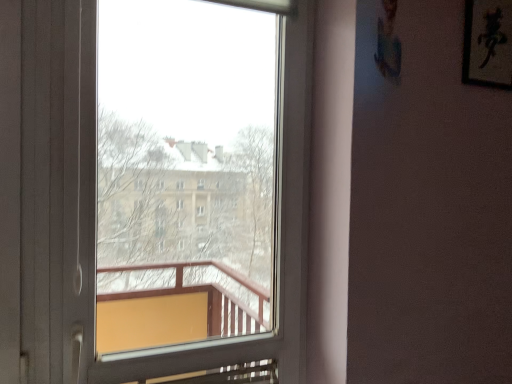
Locate an element on the screen. The width and height of the screenshot is (512, 384). black paper at upper right is located at coordinates (488, 43).

Image resolution: width=512 pixels, height=384 pixels. What do you see at coordinates (488, 43) in the screenshot? I see `black paper at upper right` at bounding box center [488, 43].

This screenshot has height=384, width=512. Describe the element at coordinates (280, 224) in the screenshot. I see `transparent glass window at center` at that location.

In the scene shown: What is the approximate width of transparent glass window at center?

transparent glass window at center is 3.85 inches in width.

Where is `transparent glass window at center`? This screenshot has height=384, width=512. transparent glass window at center is located at coordinates (280, 224).

Where is `black paper at upper right`? black paper at upper right is located at coordinates (488, 43).

Considering the relative positions of transparent glass window at center and black paper at upper right in the image provided, is transparent glass window at center to the left or to the right of black paper at upper right?

Based on their positions, transparent glass window at center is located to the left of black paper at upper right.

Is transparent glass window at center further to the viewer compared to black paper at upper right?

No, the depth of transparent glass window at center is less than that of black paper at upper right.

Which is closer, (287,76) or (510,39)?

The point (287,76) is in front.

From the image's perspective, is transparent glass window at center over black paper at upper right?

No, from the image's perspective, transparent glass window at center is not over black paper at upper right.

From a real-world perspective, is transparent glass window at center physically above black paper at upper right?

No, from a real-world perspective, transparent glass window at center is not over black paper at upper right

Considering the sizes of transparent glass window at center and black paper at upper right in the image, is transparent glass window at center wider or thinner than black paper at upper right?

transparent glass window at center is wider than black paper at upper right.

Who is shorter, transparent glass window at center or black paper at upper right?

black paper at upper right.

Considering the sizes of objects transparent glass window at center and black paper at upper right in the image provided, who is smaller, transparent glass window at center or black paper at upper right?

With smaller size is black paper at upper right.

Based on the photo, is black paper at upper right surrounded by transparent glass window at center?

Definitely not — black paper at upper right is not inside transparent glass window at center.

Looking at this image, is transparent glass window at center in contact with black paper at upper right?

No, transparent glass window at center is not with black paper at upper right.

Is transparent glass window at center looking in the opposite direction of black paper at upper right?

No, transparent glass window at center's orientation is not away from black paper at upper right.

How different are the orientations of transparent glass window at center and black paper at upper right in degrees?

The angle between the facing direction of transparent glass window at center and the facing direction of black paper at upper right is 0.973 degrees.

Measure the distance from transparent glass window at center to black paper at upper right.

transparent glass window at center and black paper at upper right are 27.69 inches apart.

In order to click on window below the black paper at upper right (from a real-world perspective) in this screenshot , I will do `click(280, 224)`.

Does black paper at upper right appear on the right side of transparent glass window at center?

Yes.

Considering the positions of objects black paper at upper right and transparent glass window at center in the image provided, who is behind, black paper at upper right or transparent glass window at center?

black paper at upper right is behind.

Is point (504, 41) closer or farther from the camera than point (139, 369)?

Point (504, 41) is farther from the camera than point (139, 369).

From the image's perspective, is black paper at upper right on top of transparent glass window at center?

Indeed, from the image's perspective, black paper at upper right is shown above transparent glass window at center.

From a real-world perspective, which is physically above, black paper at upper right or transparent glass window at center?

black paper at upper right is physically above.

Does black paper at upper right have a lesser width compared to transparent glass window at center?

Yes, black paper at upper right is thinner than transparent glass window at center.

Considering the sizes of objects black paper at upper right and transparent glass window at center in the image provided, who is shorter, black paper at upper right or transparent glass window at center?

black paper at upper right is shorter.

Does black paper at upper right have a smaller size compared to transparent glass window at center?

Correct, black paper at upper right occupies less space than transparent glass window at center.

Is black paper at upper right spatially inside transparent glass window at center, or outside of it?

black paper at upper right cannot be found inside transparent glass window at center.

Is black paper at upper right positioned far away from transparent glass window at center?

black paper at upper right is near transparent glass window at center, not far away.

Based on the photo, does black paper at upper right turn towards transparent glass window at center?

No, black paper at upper right is not turned towards transparent glass window at center.

Can you tell me how much black paper at upper right and transparent glass window at center differ in facing direction?

The angle between the facing direction of black paper at upper right and the facing direction of transparent glass window at center is 0.973 degrees.

Image resolution: width=512 pixels, height=384 pixels. I want to click on picture frame on the right of transparent glass window at center, so click(488, 43).

The height and width of the screenshot is (384, 512). I want to click on window below the black paper at upper right (from a real-world perspective), so click(x=280, y=224).

You are a GUI agent. You are given a task and a screenshot of the screen. Output one action in this format:
    pyautogui.click(x=<x>, y=<y>)
    Task: Click on the picture frame that is on the right side of transparent glass window at center
    The image size is (512, 384).
    Given the screenshot: What is the action you would take?
    pyautogui.click(x=488, y=43)